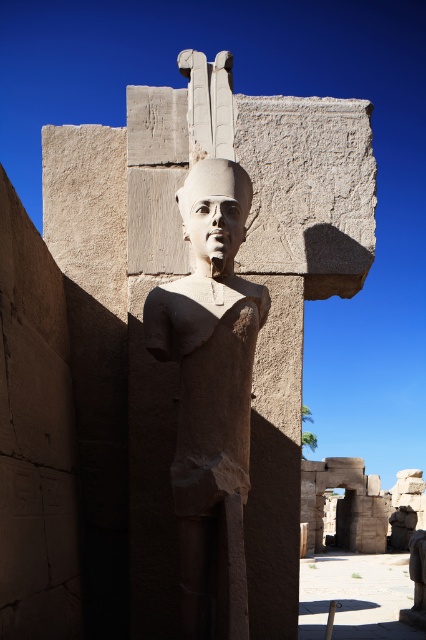
Is smooth stone statue at center positioned behind smooth stone head at center?

Yes, smooth stone statue at center is behind smooth stone head at center.

The height and width of the screenshot is (640, 426). Identify the location of smooth stone statue at center. click(x=247, y=278).

Identify the location of smooth stone statue at center. This screenshot has width=426, height=640. [x=247, y=278].